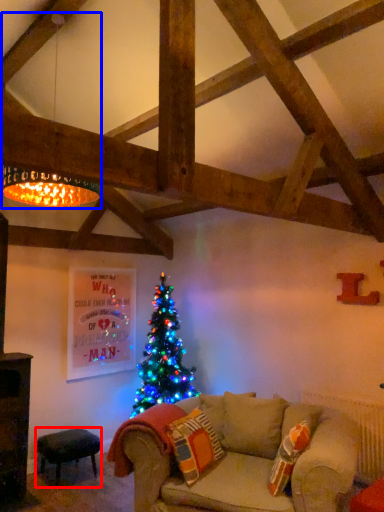
Question: Which object is further to the camera taking this photo, stool (highlighted by a red box) or lamp (highlighted by a blue box)?

Choices:
 (A) stool
 (B) lamp

Answer: (A)